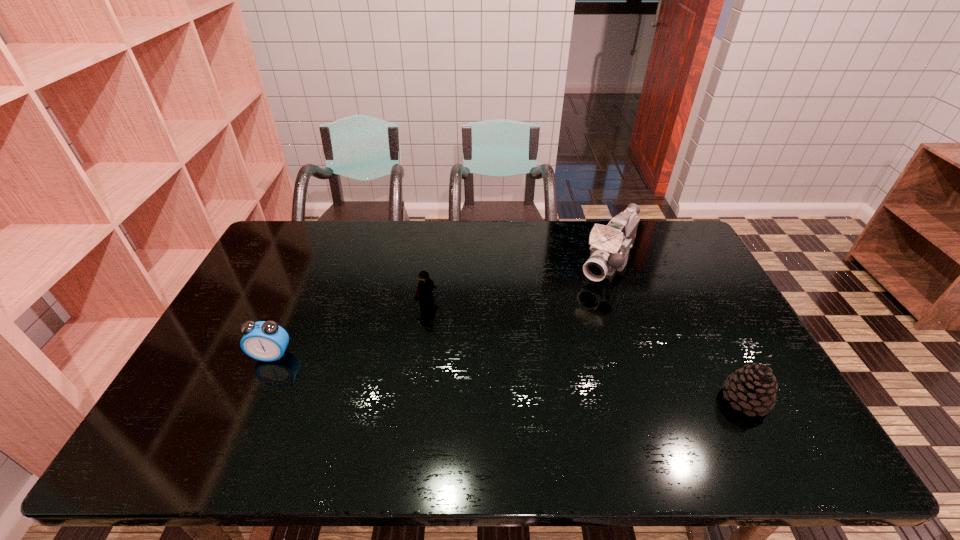
Locate an element on the screen. the second nearest object is located at coordinates (266, 341).

Where is `alarm clock`? The width and height of the screenshot is (960, 540). alarm clock is located at coordinates (266, 341).

Identify the location of pinecone. (753, 388).

At what (x,y) coordinates should I click in order to perform the action: click on the nearest object. Please return your answer as a coordinate pair (x, y). This screenshot has width=960, height=540. Looking at the image, I should click on (753, 388).

At what (x,y) coordinates should I click in order to perform the action: click on the farthest object. Please return your answer as a coordinate pair (x, y). The height and width of the screenshot is (540, 960). Looking at the image, I should click on (x=610, y=245).

Identify the location of the second object from right to left. This screenshot has height=540, width=960. (610, 245).

What are the coordinates of `the second object from left to right` in the screenshot? It's located at (425, 287).

This screenshot has width=960, height=540. Find the location of `the second farthest object`. the second farthest object is located at coordinates pos(425,287).

You are a GUI agent. You are given a task and a screenshot of the screen. Output one action in this format:
    pyautogui.click(x=<x>, y=<y>)
    Task: Click on the free location located on the face of the alarm clock
    Image resolution: width=960 pixels, height=540 pixels.
    Given the screenshot: What is the action you would take?
    pyautogui.click(x=258, y=384)

The image size is (960, 540). In order to click on vacant space located 0.140m on the front-facing side of the camcorder in this screenshot , I will do `click(579, 312)`.